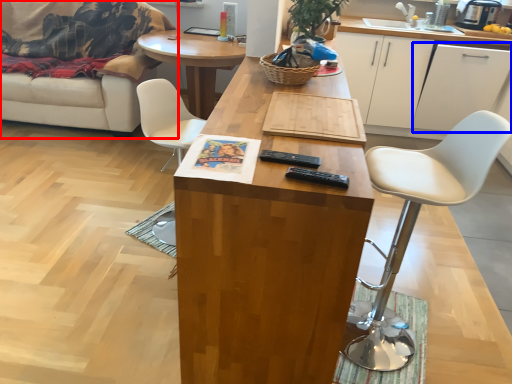
Question: Which of the following is the closest to the observer, studio couch (highlighted by a red box) or cabinetry (highlighted by a blue box)?

Choices:
 (A) studio couch
 (B) cabinetry

Answer: (A)